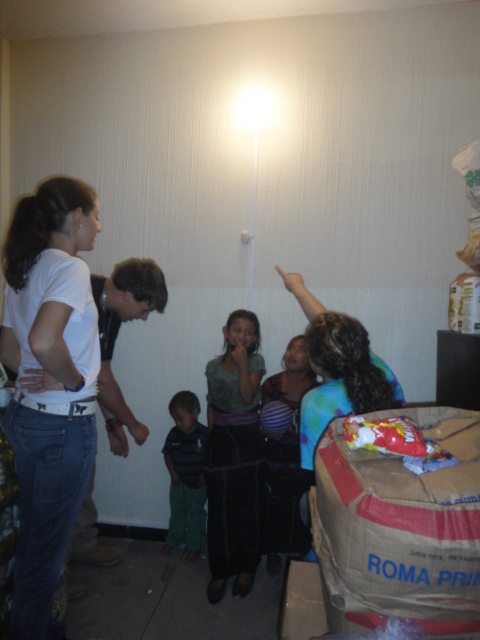
You are a tailor measuring shirts for alterations. You have a table that can only accommodate shirts wider than 12 inches. You need to place both the white matte shirt at left and the striped polo shirt at center on the table. Can both shirts fit on the table?

The white matte shirt at left might be wider than striped polo shirt at center, but since the table requires shirts wider than 12 inches, we need to know the exact width. However, the description only states a comparative width between the two shirts, not their absolute measurements. Therefore, it is uncertain if both shirts will fit on the table without knowing their specific widths.

You are standing in the room and want to hand a book to both the white matte shirt at left and the striped polo shirt at center. Which person should you approach first to ensure you can reach them without moving further into the room?

You should approach the white matte shirt at left first because it is closer to you than the striped polo shirt at center, so you can reach them without moving further into the room.